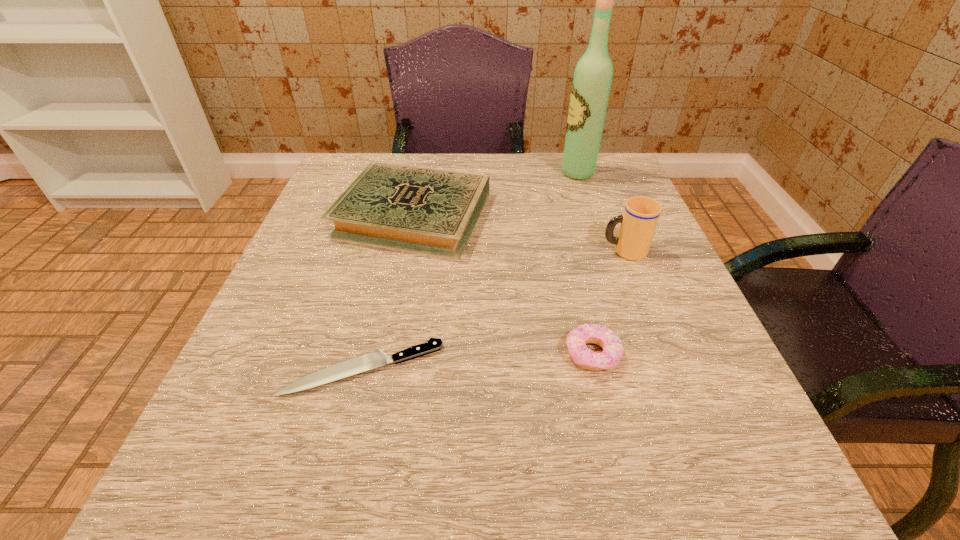
The image size is (960, 540). I want to click on wine bottle, so click(x=591, y=85).

Find the location of a particular element. the second tallest object is located at coordinates (639, 220).

Locate an element on the screen. hardback book is located at coordinates (430, 211).

Where is `doughnut`? doughnut is located at coordinates (576, 340).

Locate an element on the screen. The image size is (960, 540). steak knife is located at coordinates (375, 359).

This screenshot has width=960, height=540. I want to click on free spot located 0.160m on the front-facing side of the wine bottle, so click(496, 173).

Locate an element on the screen. The height and width of the screenshot is (540, 960). vacant space located 0.150m on the front-facing side of the wine bottle is located at coordinates (501, 173).

Find the location of a particular element. vacant space located on the front-facing side of the wine bottle is located at coordinates (424, 173).

Where is `free spot located on the side of the cup with the handle`? The height and width of the screenshot is (540, 960). free spot located on the side of the cup with the handle is located at coordinates click(494, 251).

This screenshot has height=540, width=960. Find the location of `vacant space located 0.200m on the side of the cup with the handle`. vacant space located 0.200m on the side of the cup with the handle is located at coordinates (499, 251).